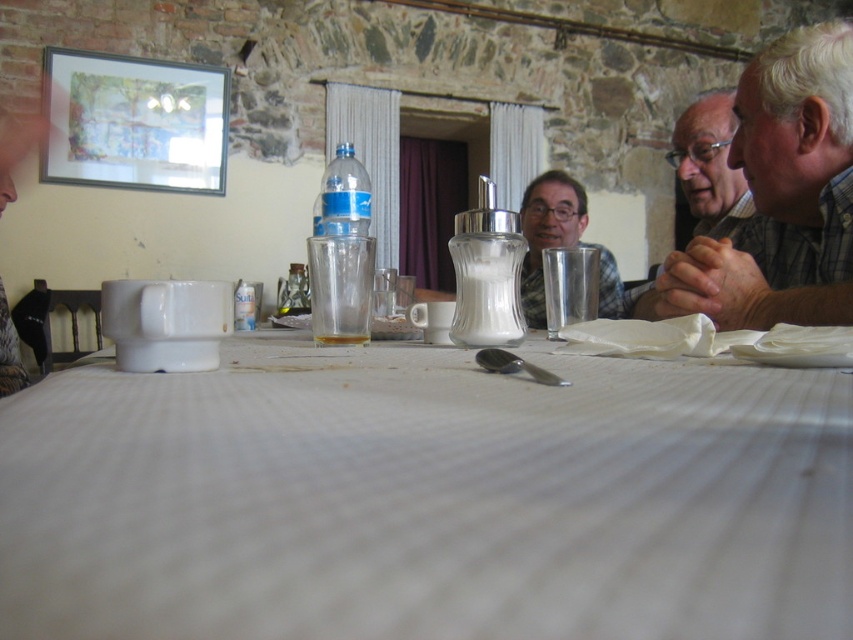
Question: Which of these objects is positioned farthest from the matte black shirt at upper right?

Choices:
 (A) white textured tablecloth at center
 (B) translucent glass at center
 (C) plaid shirt at right

Answer: (A)

Question: Which point is closer to the camera?

Choices:
 (A) (808, 134)
 (B) (701, 109)

Answer: (A)

Question: Which object appears farthest from the camera in this image?

Choices:
 (A) white textured tablecloth at center
 (B) translucent glass at center

Answer: (B)

Question: Is white textured tablecloth at center above translucent glass at center?

Choices:
 (A) yes
 (B) no

Answer: (B)

Question: Is white textured tablecloth at center closer to camera compared to plaid shirt at right?

Choices:
 (A) no
 (B) yes

Answer: (B)

Question: Where is plaid shirt at right located in relation to matte black shirt at upper right in the image?

Choices:
 (A) above
 (B) below

Answer: (B)